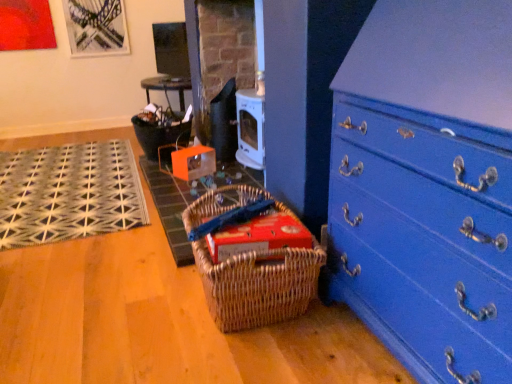
Question: Is point (406, 246) closer or farther from the camera than point (148, 150)?

Choices:
 (A) closer
 (B) farther

Answer: (A)

Question: Relative to matte black basket at center, is blue painted wood chest of drawers at lower right in front or behind?

Choices:
 (A) behind
 (B) front

Answer: (B)

Question: Considering the real-world distances, which object is closest to the blue painted wood chest of drawers at lower right?

Choices:
 (A) woven mat at center, the first doormat in the right-to-left sequence
 (B) woven brown picnic basket at lower center
 (C) black woven mat at left, which is the first doormat from left to right
 (D) matte black basket at center
 (E) red cardboard box at center

Answer: (B)

Question: Which is farther from the blue painted wood chest of drawers at lower right?

Choices:
 (A) matte black basket at center
 (B) woven brown picnic basket at lower center
 (C) woven mat at center, the first doormat in the right-to-left sequence
 (D) red cardboard box at center
 (E) black woven mat at left, acting as the second doormat starting from the right

Answer: (A)